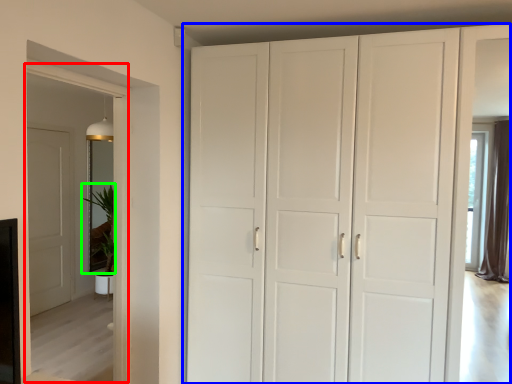
Question: Based on their relative distances, which object is farther from glass door (highlighted by a red box)? Choose from cupboard (highlighted by a blue box) and plant (highlighted by a green box).

Choices:
 (A) cupboard
 (B) plant

Answer: (B)